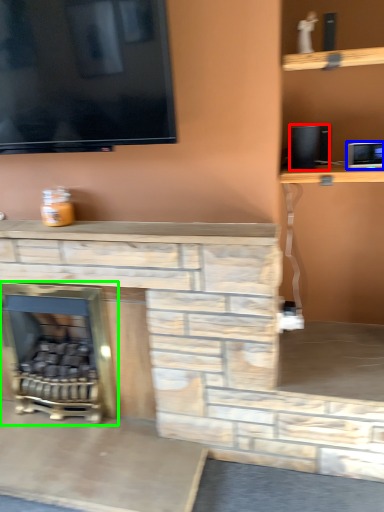
Question: Which is nearer to the speaker (highlighted by a red box)? appliance (highlighted by a blue box) or fireplace (highlighted by a green box).

Choices:
 (A) appliance
 (B) fireplace

Answer: (A)